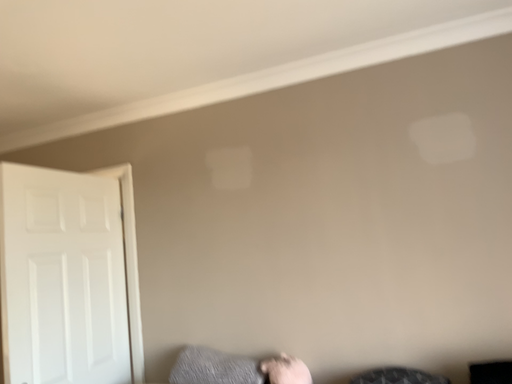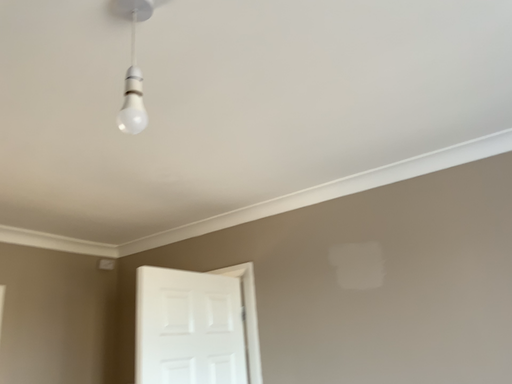
Question: Which way did the camera rotate in the video?

Choices:
 (A) rotated right
 (B) rotated left

Answer: (B)